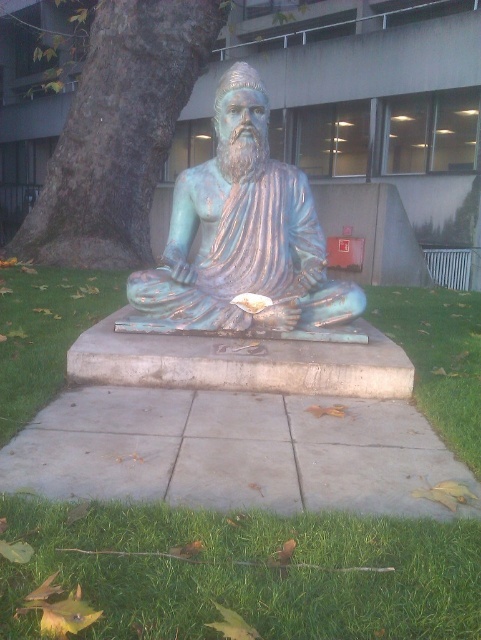
At what (x,y) coordinates should I click in order to perform the action: click on green rough bark at left. Please return your answer as a coordinate pair (x, y). The image size is (481, 640). Looking at the image, I should click on (118, 132).

Does point (130, 141) come behind point (428, 378)?

Yes, point (130, 141) is farther from viewer.

I want to click on green rough bark at left, so click(x=118, y=132).

Who is lower down, green patina statue at center or green grass at lower right?

green grass at lower right is below.

Is point (247, 237) positioned after point (441, 413)?

Yes, it is behind point (441, 413).

Who is more distant from viewer, (215,330) or (367,316)?

The point (367,316) is more distant.

You are a GUI agent. You are given a task and a screenshot of the screen. Output one action in this format:
    pyautogui.click(x=<x>, y=<y>)
    Task: Click on the green patina statue at center
    This screenshot has width=481, height=640.
    Given the screenshot: What is the action you would take?
    pyautogui.click(x=240, y=236)

Who is taller, green patina statue at center or green rough bark at left?

green rough bark at left is taller.

Is point (211, 172) positioned in front of point (182, 104)?

Yes, point (211, 172) is in front of point (182, 104).

Find the location of a particular element. Image resolution: width=481 pixels, height=640 pixels. green patina statue at center is located at coordinates (240, 236).